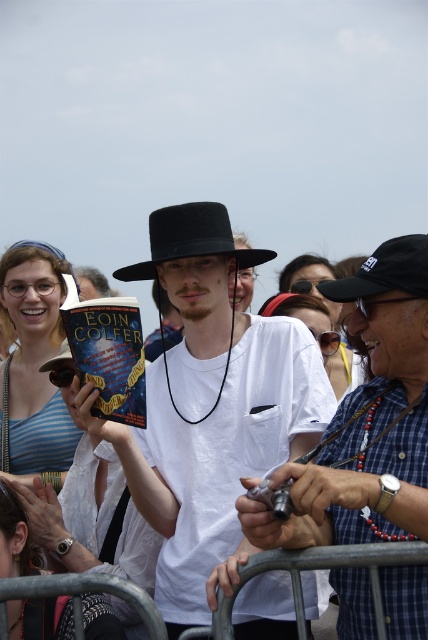
You are standing at a distance of 25 meters from the scene. Is the point at coordinates point (169, 237) closer to you than the rest of the scene?

The distance of point (169, 237) from viewer is 31.96 meters, so the point is farther away than your current position at 25 meters.

What object is located at the coordinate point (366, 419) in the scene?

The point (366, 419) is on the matte black hat at center.